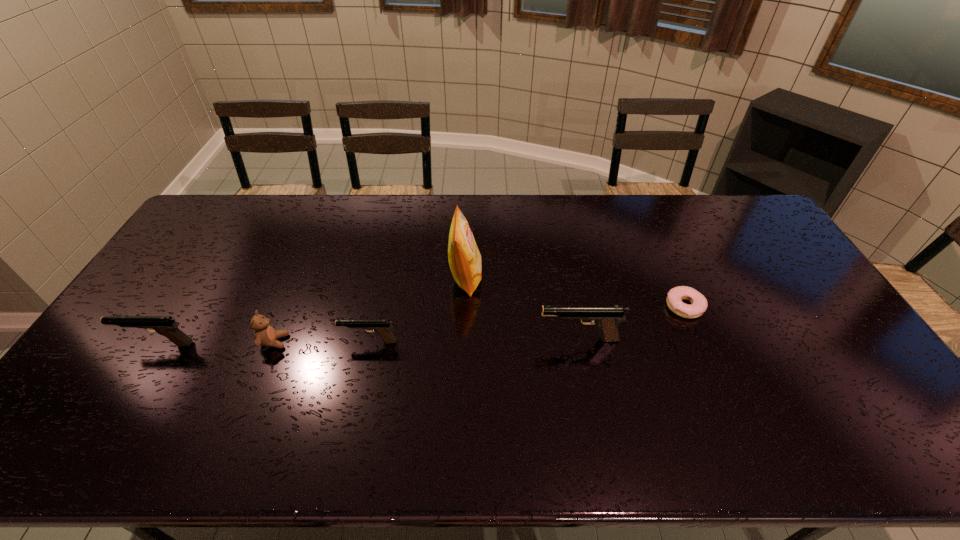
Locate an element on the screen. The height and width of the screenshot is (540, 960). pistol that is the closest to the rightmost pistol is located at coordinates (382, 327).